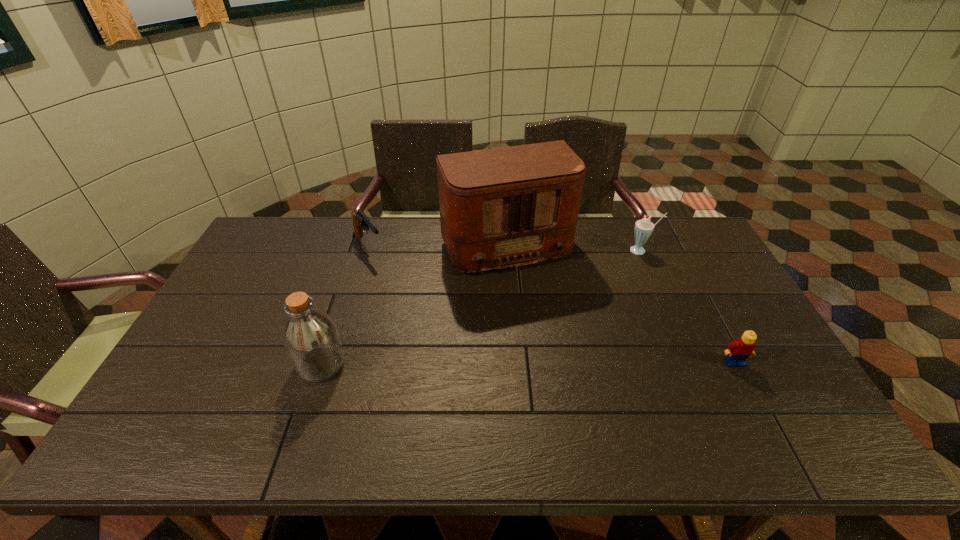
Locate an element on the screen. This screenshot has width=960, height=540. free spot on the desktop that is between the fourth shortest object and the rightmost object and is positioned on the front panel of the tallest object is located at coordinates (560, 363).

Where is `free space on the desktop that is between the bottle and the rightmost object and is positioned along the barrel of the gun`? This screenshot has height=540, width=960. free space on the desktop that is between the bottle and the rightmost object and is positioned along the barrel of the gun is located at coordinates (468, 363).

Find the location of a particular element. This screenshot has height=540, width=960. free space on the desktop that is between the bottle and the rightmost object and is positioned on the straw side of the third tallest object is located at coordinates (534, 363).